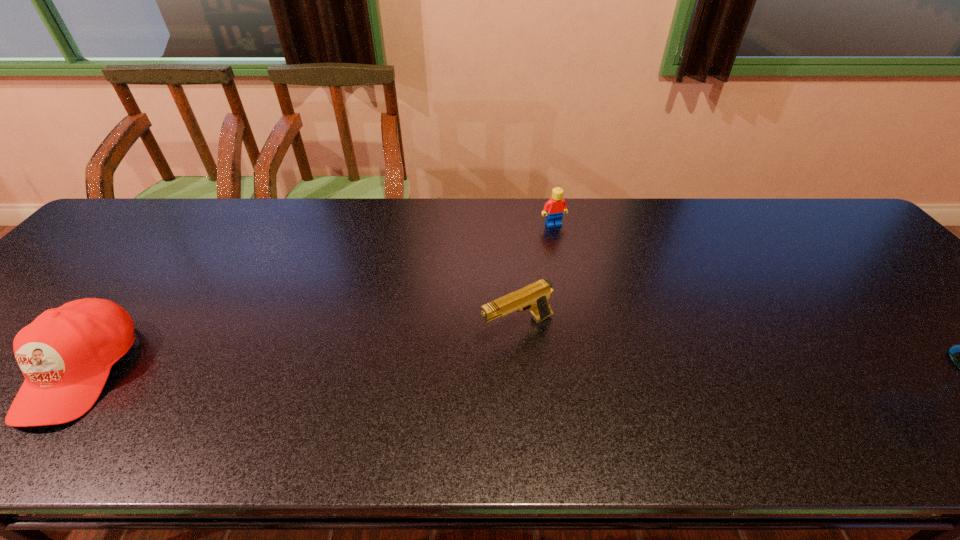
Where is `vacant region at the far edge`? vacant region at the far edge is located at coordinates (758, 245).

Where is `blank space at the near edge of the desktop`? blank space at the near edge of the desktop is located at coordinates (488, 394).

The height and width of the screenshot is (540, 960). Find the location of `blank area at the right edge`. blank area at the right edge is located at coordinates (900, 281).

Identify the location of vacant region at the far left corner of the desktop. The height and width of the screenshot is (540, 960). (162, 199).

I want to click on empty space between the second object from right to left and the rightmost object, so click(x=536, y=276).

Where is `empty space that is in between the second object from left to right and the rightmost object`? empty space that is in between the second object from left to right and the rightmost object is located at coordinates (536, 276).

Find the location of a particular element. The height and width of the screenshot is (540, 960). object that can be found as the closest to the pistol is located at coordinates (556, 206).

The image size is (960, 540). Find the location of `the second closest object relative to the rightmost object`. the second closest object relative to the rightmost object is located at coordinates (66, 354).